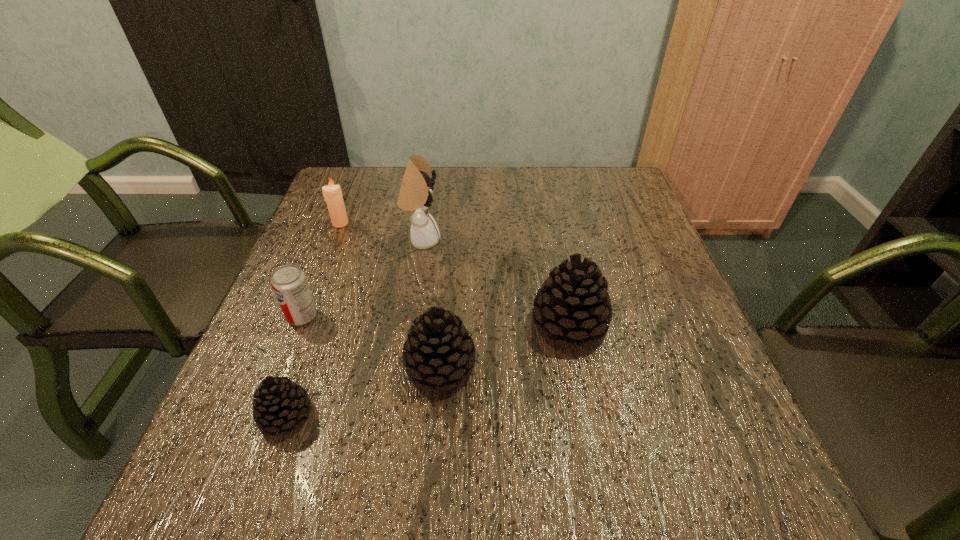
Locate an element on the screen. The image size is (960, 540). free space that is in between the soda and the shortest object is located at coordinates (294, 366).

Find the location of a particular element. Image resolution: width=960 pixels, height=540 pixels. unoccupied position between the leftmost pinecone and the doll is located at coordinates (354, 328).

Select which object is the closest to the candle. Please provide its 2D coordinates. Your answer should be formatted as a tuple, i.e. [(x, y)], where the tuple contains the x and y coordinates of a point satisfying the conditions above.

[(415, 195)]

Select which object is the third closest to the doll. Please provide its 2D coordinates. Your answer should be formatted as a tuple, i.e. [(x, y)], where the tuple contains the x and y coordinates of a point satisfying the conditions above.

[(573, 303)]

Select which pinecone is the second closest to the second pinecone from right to left. Please provide its 2D coordinates. Your answer should be formatted as a tuple, i.e. [(x, y)], where the tuple contains the x and y coordinates of a point satisfying the conditions above.

[(280, 403)]

Locate which pinecone ranks in proximity to the rightmost pinecone. Please provide its 2D coordinates. Your answer should be formatted as a tuple, i.e. [(x, y)], where the tuple contains the x and y coordinates of a point satisfying the conditions above.

[(439, 350)]

You are a GUI agent. You are given a task and a screenshot of the screen. Output one action in this format:
    pyautogui.click(x=<x>, y=<y>)
    Task: Click on the vacant position in the image that satisfies the following two spatial constraints: 1. at the front face of the doll; 2. on the front side of the soda
    
    Given the screenshot: What is the action you would take?
    pyautogui.click(x=410, y=316)